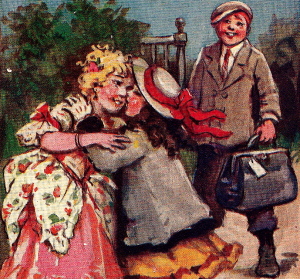
Locate an element on the screen. Image resolution: width=300 pixels, height=279 pixels. floor is located at coordinates (241, 226).